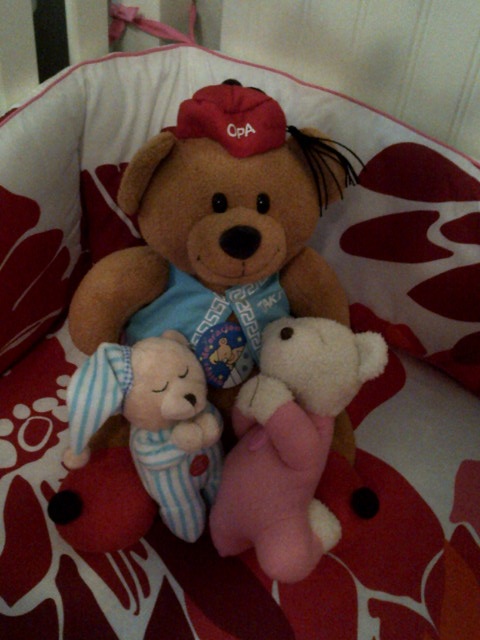
Identify the location of pillow. The image size is (480, 640). (104, 98).